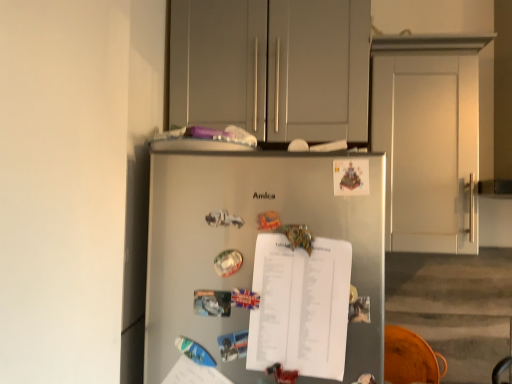
Question: From a real-world perspective, is matte gray cabinets at upper center located beneath orange wood swivel chair at lower right?

Choices:
 (A) no
 (B) yes

Answer: (A)

Question: From a real-world perspective, is matte gray cabinets at upper center physically above orange wood swivel chair at lower right?

Choices:
 (A) no
 (B) yes

Answer: (B)

Question: From the image's perspective, is matte gray cabinets at upper center under orange wood swivel chair at lower right?

Choices:
 (A) yes
 (B) no

Answer: (B)

Question: Considering the relative sizes of matte gray cabinets at upper center and orange wood swivel chair at lower right in the image provided, is matte gray cabinets at upper center bigger than orange wood swivel chair at lower right?

Choices:
 (A) no
 (B) yes

Answer: (B)

Question: Is orange wood swivel chair at lower right at the back of matte gray cabinets at upper center?

Choices:
 (A) no
 (B) yes

Answer: (A)

Question: In terms of height, does orange wood swivel chair at lower right look taller or shorter compared to satin silver refrigerator at center?

Choices:
 (A) tall
 (B) short

Answer: (B)

Question: Looking at their shapes, would you say orange wood swivel chair at lower right is wider or thinner than satin silver refrigerator at center?

Choices:
 (A) wide
 (B) thin

Answer: (B)

Question: Looking at the image, does orange wood swivel chair at lower right seem bigger or smaller compared to satin silver refrigerator at center?

Choices:
 (A) small
 (B) big

Answer: (A)

Question: In the image, is orange wood swivel chair at lower right on the left side or the right side of satin silver refrigerator at center?

Choices:
 (A) left
 (B) right

Answer: (B)

Question: From a real-world perspective, is white paper at center positioned above or below satin silver refrigerator at center?

Choices:
 (A) above
 (B) below

Answer: (B)

Question: Is point (269, 301) positioned closer to the camera than point (225, 322)?

Choices:
 (A) closer
 (B) farther

Answer: (A)

Question: Would you say white paper at center is to the left or to the right of satin silver refrigerator at center in the picture?

Choices:
 (A) right
 (B) left

Answer: (A)

Question: From the image's perspective, relative to satin silver refrigerator at center, is white paper at center above or below?

Choices:
 (A) above
 (B) below

Answer: (B)

Question: Is white paper at center inside or outside of white matte door at upper right?

Choices:
 (A) outside
 (B) inside

Answer: (A)

Question: From the image's perspective, is white paper at center positioned above or below white matte door at upper right?

Choices:
 (A) above
 (B) below

Answer: (B)